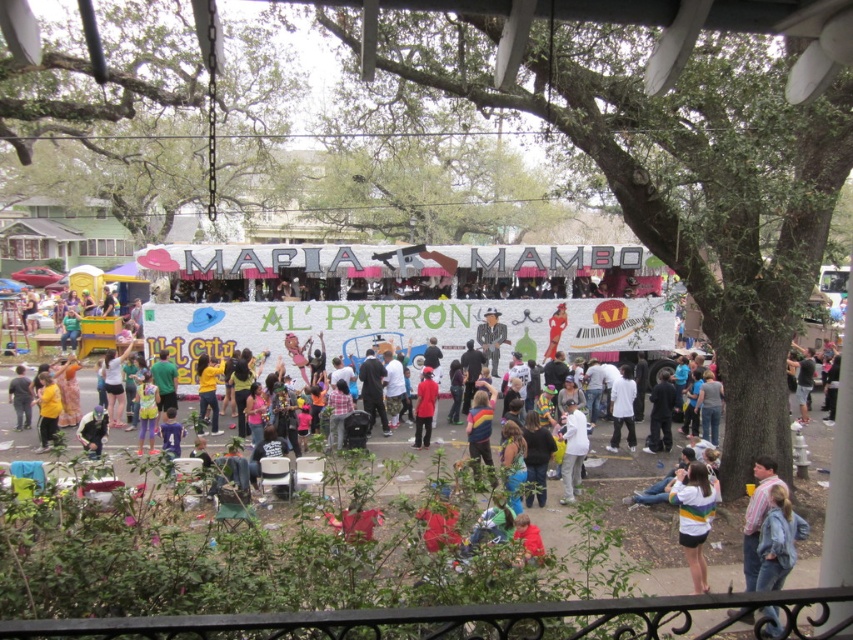
Does white cardboard signboard at center appear on the left side of white cotton shirt at center?

Correct, you'll find white cardboard signboard at center to the left of white cotton shirt at center.

Is white cardboard signboard at center above white cotton shirt at center?

Indeed, white cardboard signboard at center is positioned over white cotton shirt at center.

Is point (296, 260) positioned behind point (582, 460)?

That is True.

Where is `white cardboard signboard at center`? white cardboard signboard at center is located at coordinates (376, 310).

Consider the image. Does white cotton shirt at lower right have a greater width compared to matte red coat at center?

Indeed, white cotton shirt at lower right has a greater width compared to matte red coat at center.

Who is more forward, (697, 550) or (425, 426)?

Point (697, 550)

This screenshot has height=640, width=853. What are the coordinates of `white cotton shirt at lower right` in the screenshot? It's located at (693, 516).

The width and height of the screenshot is (853, 640). Identify the location of white cotton shirt at lower right. (693, 516).

Between point (699, 582) and point (618, 397), which one is positioned behind?

The point (618, 397) is behind.

What do you see at coordinates (693, 516) in the screenshot? I see `white cotton shirt at lower right` at bounding box center [693, 516].

Locate an element on the screen. white cotton shirt at lower right is located at coordinates (693, 516).